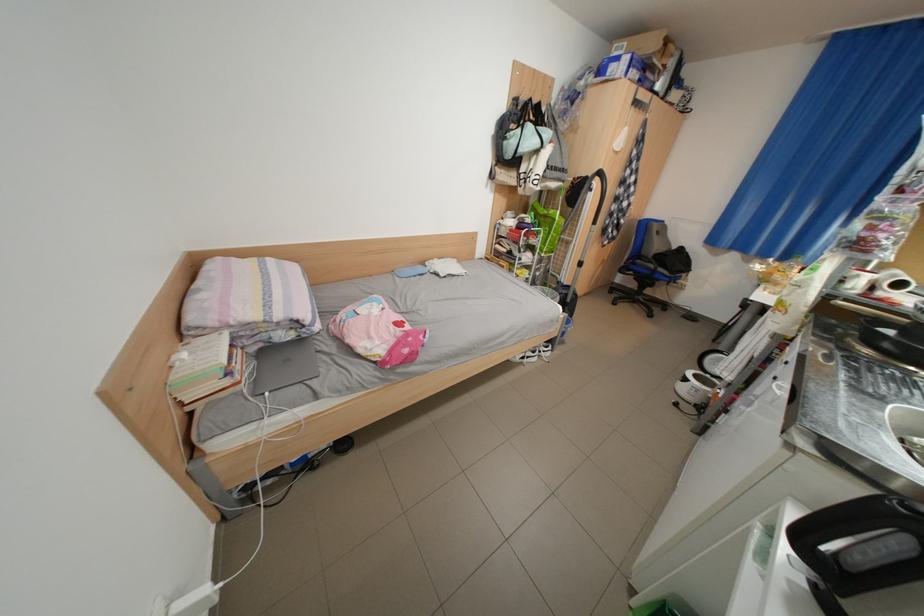
Describe the element at coordinates (572, 294) in the screenshot. The width and height of the screenshot is (924, 616). I see `the stove knob` at that location.